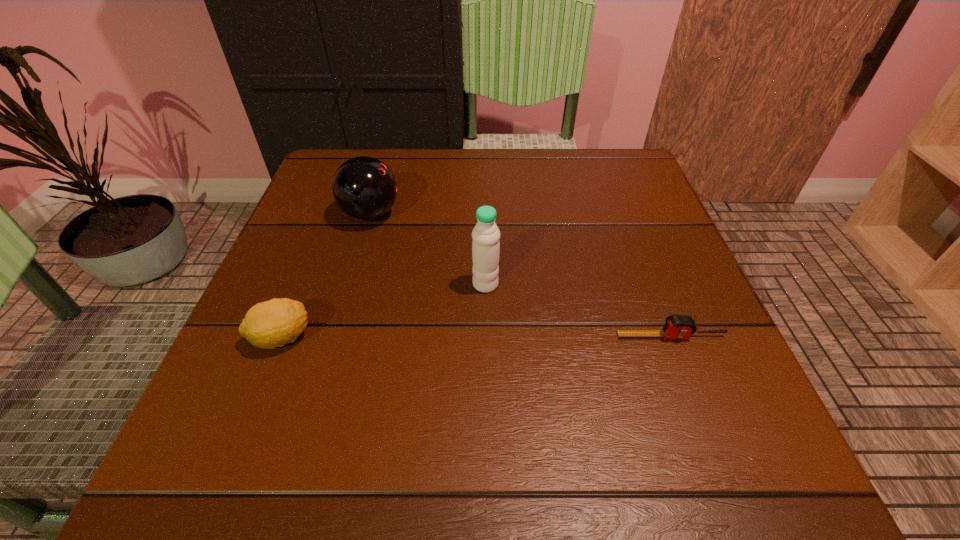
The image size is (960, 540). Identify the location of free space between the lemon and the farthest object. (325, 276).

This screenshot has width=960, height=540. Identify the location of vacant area that lies between the water bottle and the farthest object. (428, 249).

The image size is (960, 540). I want to click on vacant area between the tallest object and the lemon, so click(383, 311).

Locate which object is the second closest to the tape measure. Please provide its 2D coordinates. Your answer should be formatted as a tuple, i.e. [(x, y)], where the tuple contains the x and y coordinates of a point satisfying the conditions above.

[(364, 188)]

Identify which object is the closest to the tape measure. Please provide its 2D coordinates. Your answer should be formatted as a tuple, i.e. [(x, y)], where the tuple contains the x and y coordinates of a point satisfying the conditions above.

[(485, 245)]

The height and width of the screenshot is (540, 960). Find the location of `vacant space that satisfies the following two spatial constraints: 1. on the surface of the farthest object near the finger holes; 2. on the left side of the third nearest object`. vacant space that satisfies the following two spatial constraints: 1. on the surface of the farthest object near the finger holes; 2. on the left side of the third nearest object is located at coordinates (350, 285).

In order to click on vacant point that satisfies the following two spatial constraints: 1. on the surface of the rightmost object near the finger holes; 2. on the left side of the bowling ball in this screenshot , I will do `click(335, 336)`.

Where is `vacant region that satisfies the following two spatial constraints: 1. on the surface of the farthest object near the finger holes; 2. on the left side of the water bottle`? This screenshot has width=960, height=540. vacant region that satisfies the following two spatial constraints: 1. on the surface of the farthest object near the finger holes; 2. on the left side of the water bottle is located at coordinates (350, 285).

Locate an element on the screen. vacant space that satisfies the following two spatial constraints: 1. on the surface of the farthest object near the finger holes; 2. on the right side of the third object from left to right is located at coordinates (350, 285).

The image size is (960, 540). What are the coordinates of `free space that satisfies the following two spatial constraints: 1. on the surface of the third shortest object near the finger holes; 2. on the back side of the tape measure` in the screenshot? It's located at (335, 336).